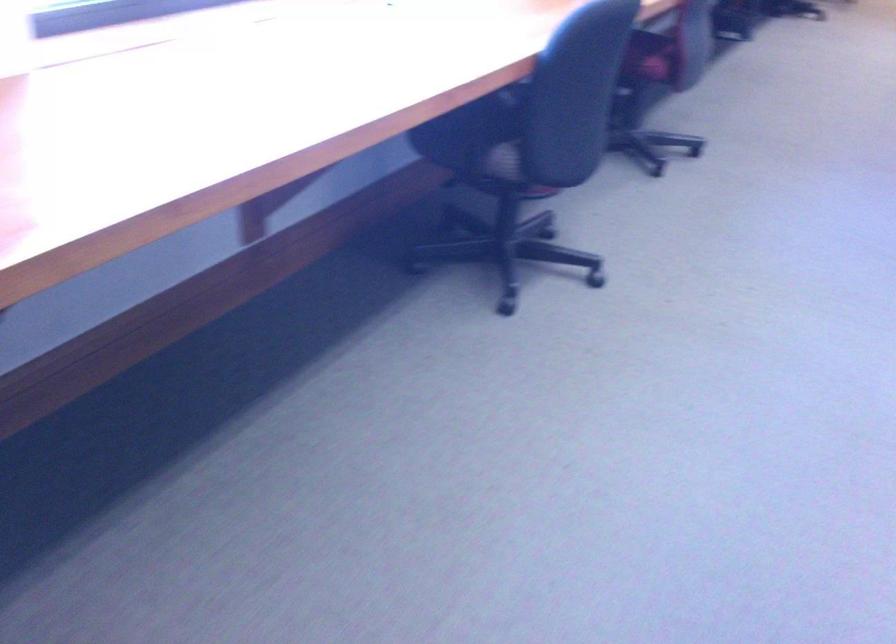
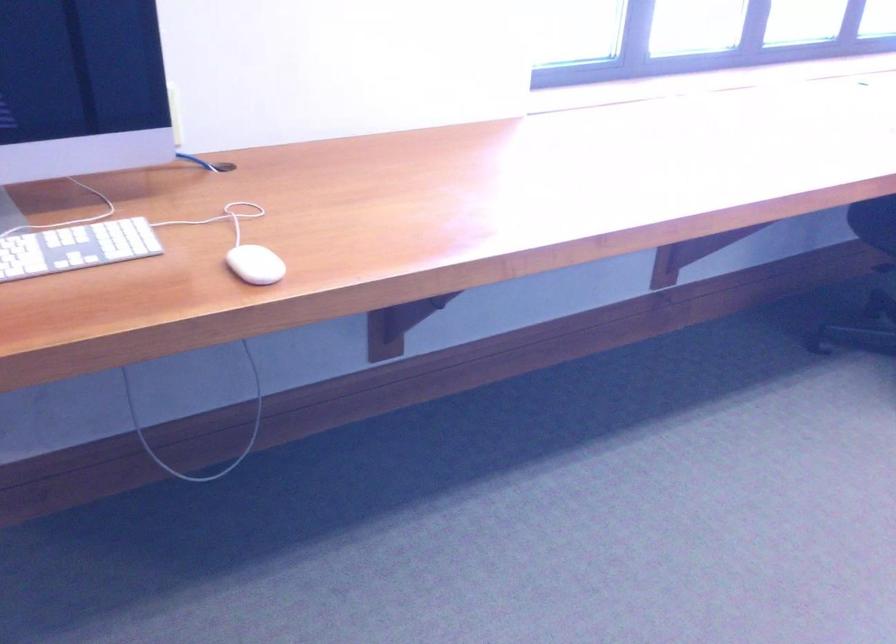
Question: The camera is either moving clockwise (left) or counter-clockwise (right) around the object. The first image is from the beginning of the video and the second image is from the end. Is the camera moving left or right when shooting the video?

Choices:
 (A) Left
 (B) Right

Answer: (B)